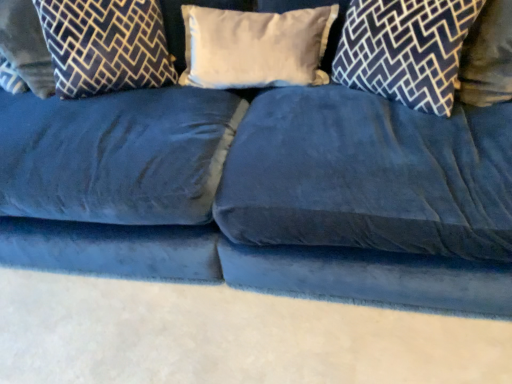
Question: Should I look upward or downward to see dark blue velvet pillow at upper right, which is the 1th pillow from right to left?

Choices:
 (A) up
 (B) down

Answer: (A)

Question: From the image's perspective, is dark blue velvet pillow at upper left, the 2th pillow from the left, on top of white soft pillow at center, which ranks as the 3th pillow in left-to-right order?

Choices:
 (A) yes
 (B) no

Answer: (A)

Question: Does dark blue velvet pillow at upper left, the 2th pillow from the left, turn towards white soft pillow at center, which is counted as the second pillow, starting from the right?

Choices:
 (A) no
 (B) yes

Answer: (A)

Question: Could white soft pillow at center, which ranks as the 3th pillow in left-to-right order, be considered to be inside dark blue velvet pillow at upper left, placed as the 3th pillow when sorted from right to left?

Choices:
 (A) yes
 (B) no

Answer: (B)

Question: Can you see dark blue velvet pillow at upper left, placed as the 3th pillow when sorted from right to left, touching white soft pillow at center, which ranks as the 3th pillow in left-to-right order?

Choices:
 (A) yes
 (B) no

Answer: (B)

Question: Is dark blue velvet pillow at upper left, placed as the 3th pillow when sorted from right to left, turned away from white soft pillow at center, which ranks as the 3th pillow in left-to-right order?

Choices:
 (A) no
 (B) yes

Answer: (A)

Question: Is dark blue velvet pillow at upper left, placed as the 3th pillow when sorted from right to left, outside of white soft pillow at center, which ranks as the 3th pillow in left-to-right order?

Choices:
 (A) yes
 (B) no

Answer: (A)

Question: Does dark blue velvet pillow at upper right, which appears as the fourth pillow when viewed from the left, lie in front of white soft pillow at center, which ranks as the 3th pillow in left-to-right order?

Choices:
 (A) yes
 (B) no

Answer: (A)

Question: Can you confirm if dark blue velvet pillow at upper right, which appears as the fourth pillow when viewed from the left, is smaller than white soft pillow at center, which ranks as the 3th pillow in left-to-right order?

Choices:
 (A) yes
 (B) no

Answer: (B)

Question: Does dark blue velvet pillow at upper right, which is the 1th pillow from right to left, appear on the left side of white soft pillow at center, which is counted as the second pillow, starting from the right?

Choices:
 (A) no
 (B) yes

Answer: (A)

Question: Is dark blue velvet pillow at upper right, which is the 1th pillow from right to left, oriented towards white soft pillow at center, which is counted as the second pillow, starting from the right?

Choices:
 (A) yes
 (B) no

Answer: (B)

Question: Considering the relative sizes of dark blue velvet pillow at upper right, which appears as the fourth pillow when viewed from the left, and white soft pillow at center, which ranks as the 3th pillow in left-to-right order, in the image provided, is dark blue velvet pillow at upper right, which appears as the fourth pillow when viewed from the left, shorter than white soft pillow at center, which ranks as the 3th pillow in left-to-right order,?

Choices:
 (A) no
 (B) yes

Answer: (A)

Question: Does dark blue velvet pillow at upper right, which is the 1th pillow from right to left, have a greater width compared to white soft pillow at center, which ranks as the 3th pillow in left-to-right order?

Choices:
 (A) no
 (B) yes

Answer: (B)

Question: Is dark blue velvet pillow at upper right, which is the 1th pillow from right to left, turned away from velvet-patterned pillow at left, which ranks as the 1th pillow in left-to-right order?

Choices:
 (A) no
 (B) yes

Answer: (A)